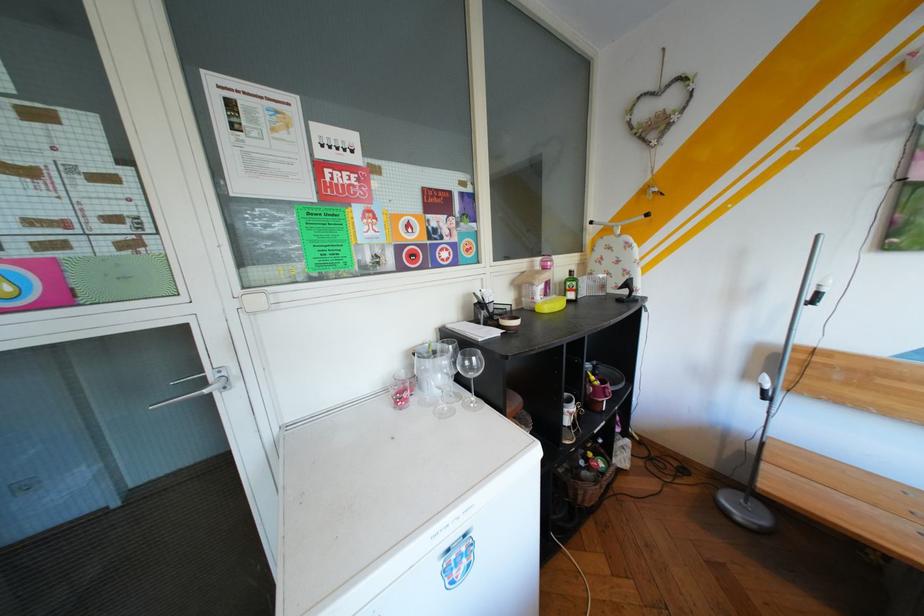
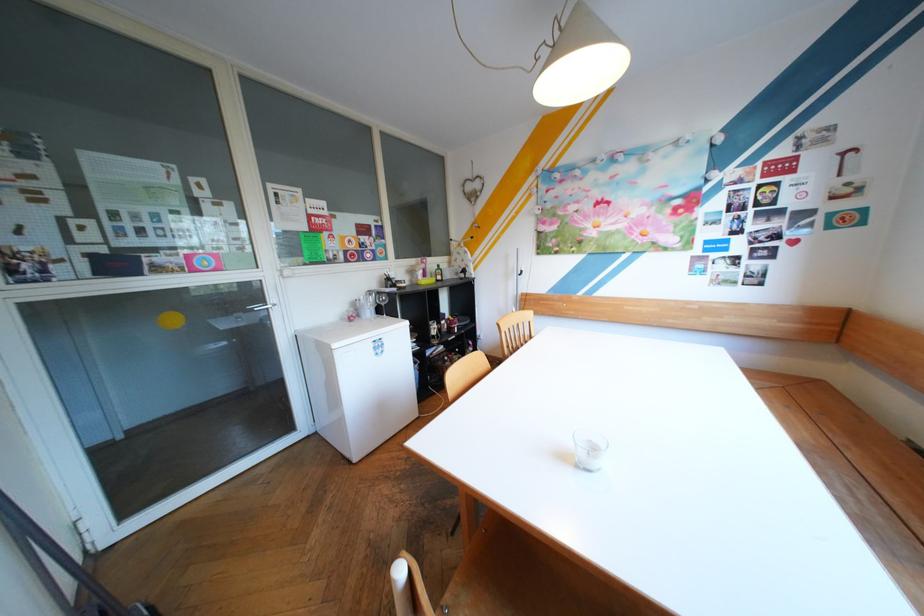
Where in the second image is the point corresponding to (554,285) from the first image?

(434, 270)